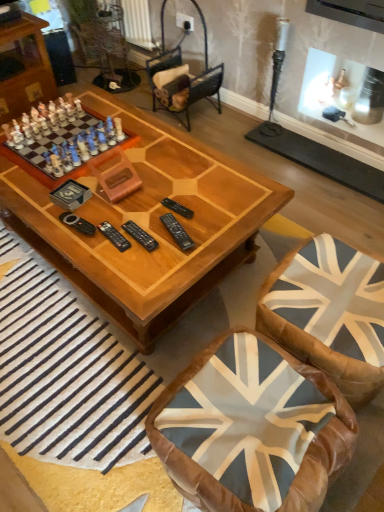
The height and width of the screenshot is (512, 384). I want to click on vacant region above porcelain chess set at left (from a real-world perspective), so click(51, 146).